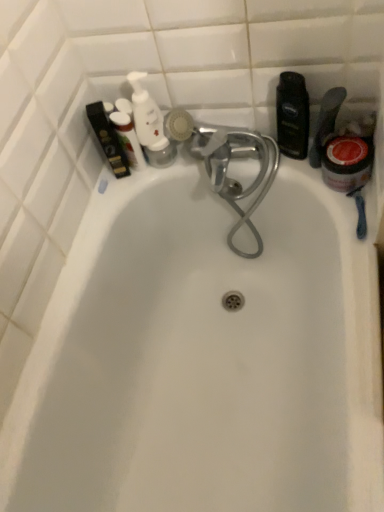
Question: Is the position of white glossy pump bottle at upper left, the 4th toiletry positioned from the right, less distant than that of white plastic pump bottle at upper left, positioned as the 3th toiletry in right-to-left order?

Choices:
 (A) yes
 (B) no

Answer: (A)

Question: Is white glossy pump bottle at upper left, which is the second toiletry in left-to-right order, positioned behind white plastic pump bottle at upper left, positioned as the 3th toiletry in right-to-left order?

Choices:
 (A) yes
 (B) no

Answer: (B)

Question: Is white glossy pump bottle at upper left, which is the second toiletry in left-to-right order, thinner than white plastic pump bottle at upper left, arranged as the third toiletry when viewed from the left?

Choices:
 (A) no
 (B) yes

Answer: (B)

Question: Considering the relative positions of white glossy pump bottle at upper left, which is the second toiletry in left-to-right order, and white plastic pump bottle at upper left, arranged as the third toiletry when viewed from the left, in the image provided, is white glossy pump bottle at upper left, which is the second toiletry in left-to-right order, to the left of white plastic pump bottle at upper left, arranged as the third toiletry when viewed from the left, from the viewer's perspective?

Choices:
 (A) no
 (B) yes

Answer: (B)

Question: Does white glossy pump bottle at upper left, the 4th toiletry positioned from the right, have a greater width compared to white plastic pump bottle at upper left, arranged as the third toiletry when viewed from the left?

Choices:
 (A) yes
 (B) no

Answer: (B)

Question: Considering the positions of translucent plastic bottle at right, which is counted as the first toiletry, starting from the right, and red glossy jar at right in the image, is translucent plastic bottle at right, which is counted as the first toiletry, starting from the right, taller or shorter than red glossy jar at right?

Choices:
 (A) tall
 (B) short

Answer: (A)

Question: Visually, is translucent plastic bottle at right, which ranks as the fifth toiletry in left-to-right order, positioned to the left or to the right of red glossy jar at right?

Choices:
 (A) right
 (B) left

Answer: (B)

Question: Is point (326, 103) positioned closer to the camera than point (360, 183)?

Choices:
 (A) farther
 (B) closer

Answer: (B)

Question: Is translucent plastic bottle at right, which is counted as the first toiletry, starting from the right, inside or outside of red glossy jar at right?

Choices:
 (A) inside
 (B) outside

Answer: (B)

Question: Visually, is translucent plastic bottle at right, which is counted as the first toiletry, starting from the right, positioned to the left or to the right of white glossy pump bottle at upper left, which is the second toiletry in left-to-right order?

Choices:
 (A) left
 (B) right

Answer: (B)

Question: From the image's perspective, is translucent plastic bottle at right, which ranks as the fifth toiletry in left-to-right order, positioned above or below white glossy pump bottle at upper left, the 4th toiletry positioned from the right?

Choices:
 (A) above
 (B) below

Answer: (B)

Question: Considering the positions of point (327, 126) and point (137, 157), is point (327, 126) closer or farther from the camera than point (137, 157)?

Choices:
 (A) farther
 (B) closer

Answer: (B)

Question: Looking at the image, does translucent plastic bottle at right, which is counted as the first toiletry, starting from the right, seem bigger or smaller compared to white glossy pump bottle at upper left, which is the second toiletry in left-to-right order?

Choices:
 (A) big
 (B) small

Answer: (A)

Question: From the image's perspective, is matte black box at upper left, which is the fifth toiletry in right-to-left order, positioned above or below red glossy jar at right?

Choices:
 (A) above
 (B) below

Answer: (A)

Question: Considering the positions of matte black box at upper left, positioned as the 1th toiletry in left-to-right order, and red glossy jar at right in the image, is matte black box at upper left, positioned as the 1th toiletry in left-to-right order, taller or shorter than red glossy jar at right?

Choices:
 (A) tall
 (B) short

Answer: (A)